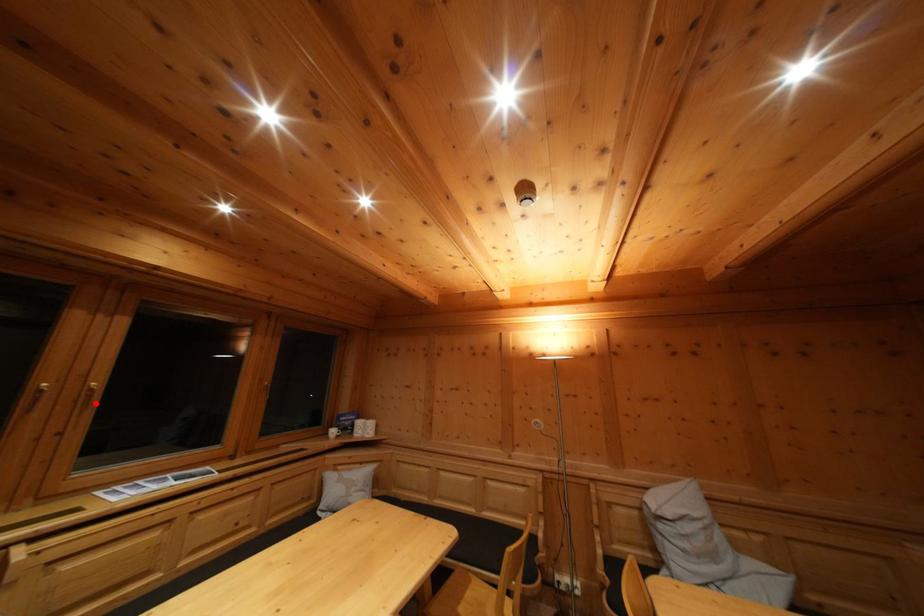
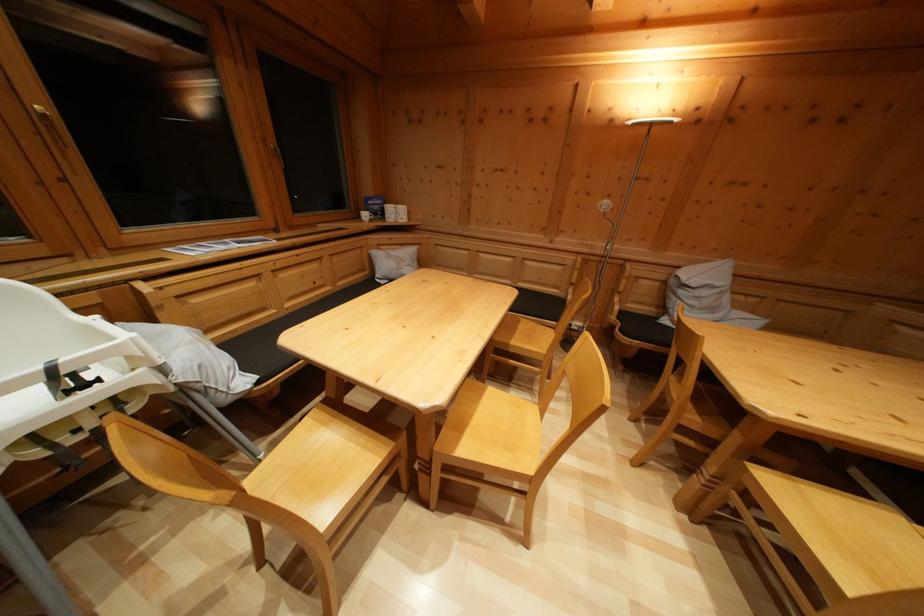
Find the pixel in the second image that matches the highlighted location in the first image.

(58, 135)